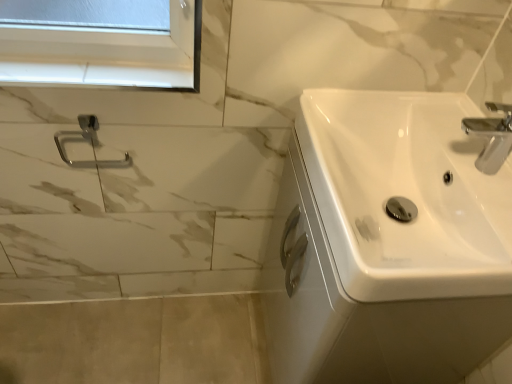
Question: Would you say white glossy window sill at upper left is to the left or to the right of satin nickel towel ring at upper left in the picture?

Choices:
 (A) right
 (B) left

Answer: (A)

Question: Considering their positions, is white glossy window sill at upper left located in front of or behind satin nickel towel ring at upper left?

Choices:
 (A) behind
 (B) front

Answer: (B)

Question: Which object is the closest to the white glossy window sill at upper left?

Choices:
 (A) satin nickel towel ring at upper left
 (B) white glossy sink at right

Answer: (A)

Question: Considering the real-world distances, which object is farthest from the satin nickel towel ring at upper left?

Choices:
 (A) white glossy sink at right
 (B) white glossy window sill at upper left

Answer: (A)